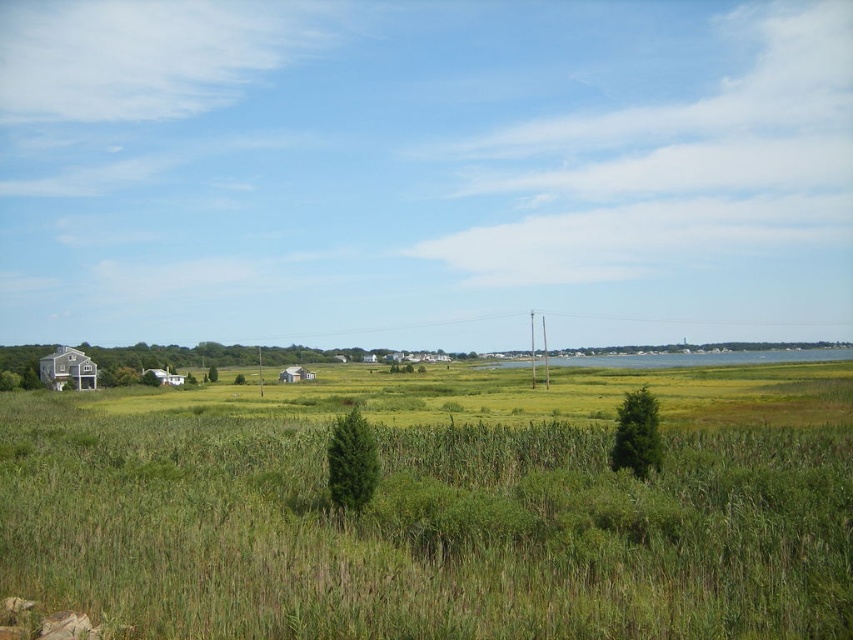
From the picture: Can you confirm if white corrugated metal hut at center is thinner than white matte house at lower left?

Incorrect, white corrugated metal hut at center's width is not less than white matte house at lower left's.

Who is taller, white corrugated metal hut at center or white matte house at lower left?

white matte house at lower left is taller.

What are the coordinates of `white corrugated metal hut at center` in the screenshot? It's located at (294, 374).

Locate an element on the screen. white corrugated metal hut at center is located at coordinates (294, 374).

Can you confirm if wooden cabin at left is bigger than white corrugated metal hut at center?

No.

Is point (42, 362) positioned before point (311, 374)?

Yes, it is.

Consider the image. Who is more distant from viewer, (x=82, y=365) or (x=283, y=381)?

Point (x=283, y=381)

Where is `wooden cabin at left`? wooden cabin at left is located at coordinates (67, 369).

Is wooden cabin at left wider than white matte house at lower left?

Correct, the width of wooden cabin at left exceeds that of white matte house at lower left.

Which is above, wooden cabin at left or white matte house at lower left?

Positioned higher is wooden cabin at left.

This screenshot has height=640, width=853. Identify the location of wooden cabin at left. (67, 369).